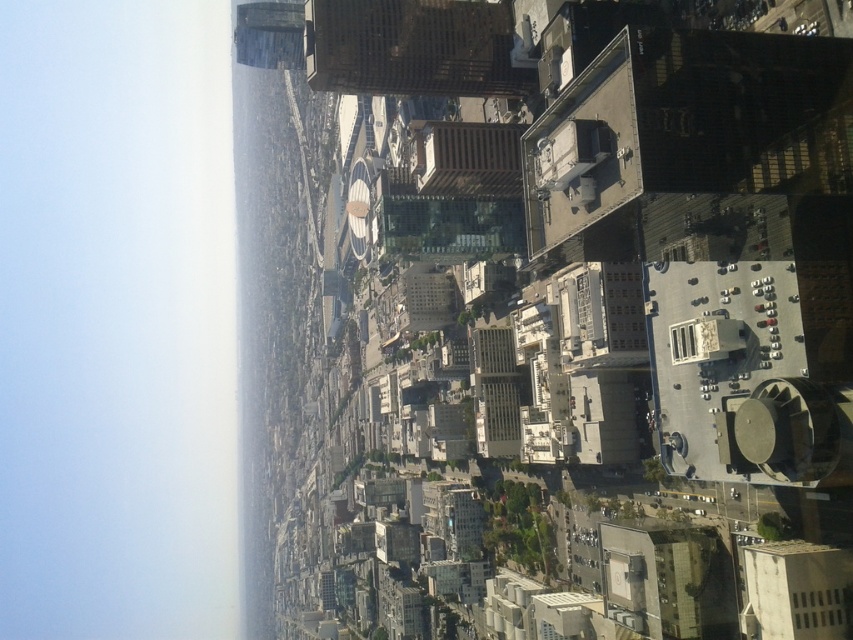
Does transparent glass window at lower right appear over transparent glass window at upper right?

Actually, transparent glass window at lower right is below transparent glass window at upper right.

Is transparent glass window at lower right to the left of transparent glass window at upper right from the viewer's perspective?

In fact, transparent glass window at lower right is to the right of transparent glass window at upper right.

Is point (821, 621) closer to viewer compared to point (695, 332)?

That is True.

The height and width of the screenshot is (640, 853). Find the location of `transparent glass window at lower right`. transparent glass window at lower right is located at coordinates (821, 608).